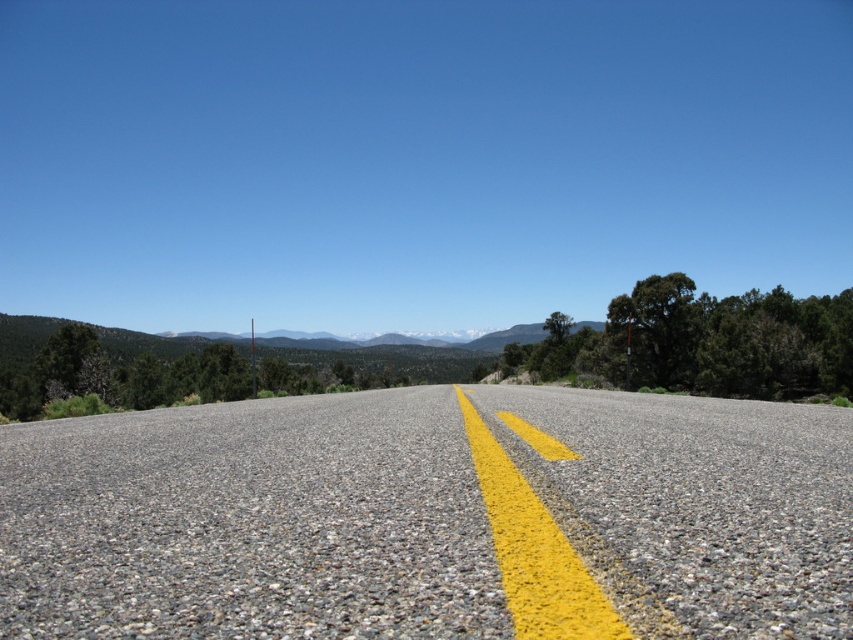
Question: Where is gray gravel at center located in relation to yellow painted line at center in the image?

Choices:
 (A) below
 (B) above

Answer: (A)

Question: Does gray gravel at center lie in front of yellow painted line at center?

Choices:
 (A) no
 (B) yes

Answer: (A)

Question: Which point is closer to the camera taking this photo?

Choices:
 (A) (645, 628)
 (B) (497, 520)

Answer: (A)

Question: Which object is farther from the camera taking this photo?

Choices:
 (A) yellow painted line at center
 (B) gray gravel at center

Answer: (B)

Question: Can you confirm if gray gravel at center is positioned above yellow painted line at center?

Choices:
 (A) no
 (B) yes

Answer: (A)

Question: Which of the following is the closest to the observer?

Choices:
 (A) (495, 502)
 (B) (480, 612)

Answer: (B)